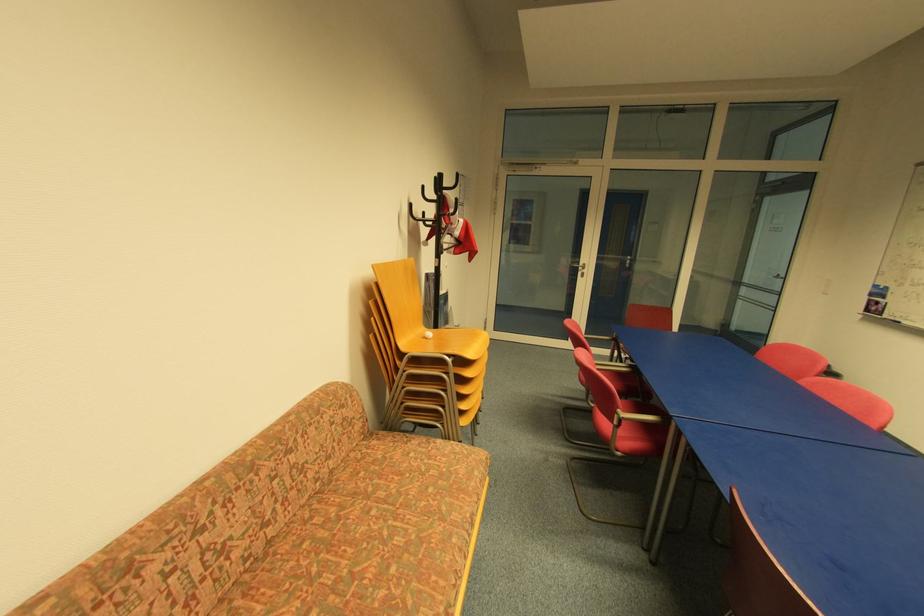
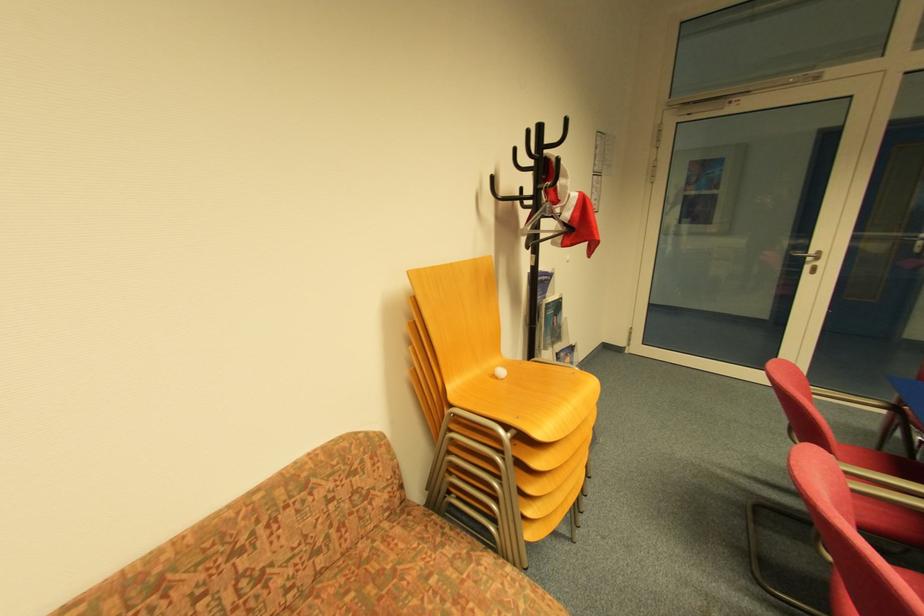
Question: In a continuous first-person perspective shot, in which direction is the camera moving?

Choices:
 (A) Left
 (B) Right
 (C) Forward
 (D) Backward

Answer: (C)